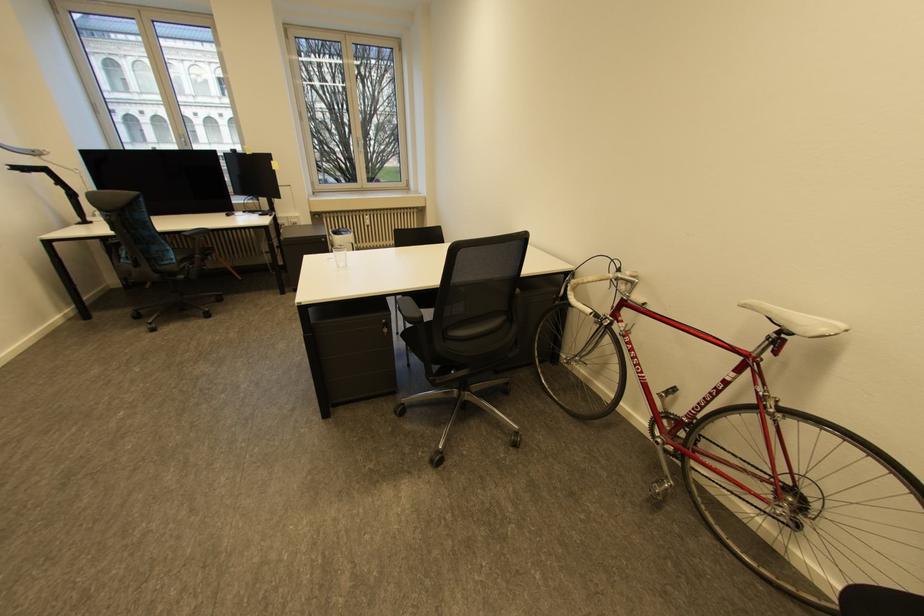
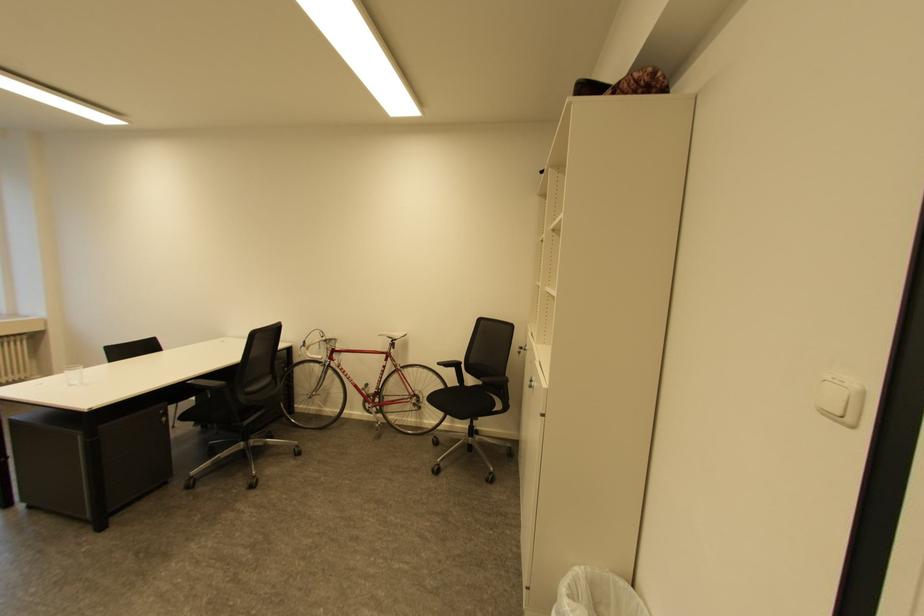
Locate, in the second image, the point that corresponds to point 785,326 in the first image.

(398, 339)